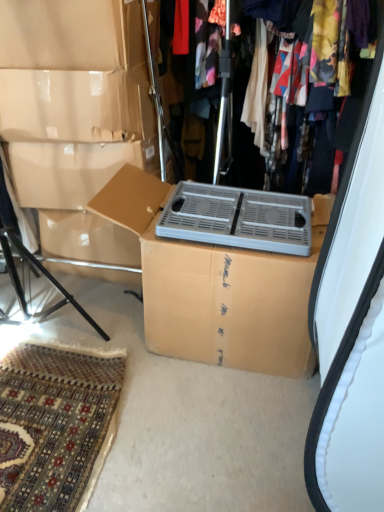
You are a GUI agent. You are given a task and a screenshot of the screen. Output one action in this format:
    pyautogui.click(x=<x>, y=<y>)
    Task: Click on the gray plastic crate at center
    
    Given the screenshot: What is the action you would take?
    pyautogui.click(x=238, y=218)

The image size is (384, 512). Identify the location of cardboard box at center. pyautogui.click(x=217, y=287).

The width and height of the screenshot is (384, 512). Describe the element at coordinates (73, 98) in the screenshot. I see `beige cardboard box at center` at that location.

Find the location of `gray plastic crate at center`. gray plastic crate at center is located at coordinates (238, 218).

Is point (156, 195) closer or farther from the camera than point (33, 13)?

Point (156, 195) appears to be farther away from the viewer than point (33, 13).

In terms of size, does cardboard box at center appear bigger or smaller than beige cardboard box at center?

cardboard box at center is bigger than beige cardboard box at center.

Does cardboard box at center lie behind beige cardboard box at center?

No, the depth of cardboard box at center is less than that of beige cardboard box at center.

Can you confirm if cardboard box at center is shorter than beige cardboard box at center?

Indeed, cardboard box at center has a lesser height compared to beige cardboard box at center.

Looking at this image, from a real-world perspective, who is located higher, gray plastic crate at center or beige cardboard box at center?

From a 3D spatial view, beige cardboard box at center is above.

Is gray plastic crate at center inside or outside of beige cardboard box at center?

gray plastic crate at center is not inside beige cardboard box at center, it's outside.

Is gray plastic crate at center facing towards beige cardboard box at center?

No.

Is metallic silver heater at upper center thinner than cardboard box at center?

Correct, the width of metallic silver heater at upper center is less than that of cardboard box at center.

From the image's perspective, is metallic silver heater at upper center positioned above or below cardboard box at center?

metallic silver heater at upper center is situated higher than cardboard box at center in the image.

Is metallic silver heater at upper center shorter than cardboard box at center?

Incorrect, the height of metallic silver heater at upper center does not fall short of that of cardboard box at center.

Is metallic silver heater at upper center at the right side of cardboard box at center?

Yes.

Is beige cardboard box at center taller than gray plastic crate at center?

Yes, beige cardboard box at center is taller than gray plastic crate at center.

In the scene shown: What's the angular difference between beige cardboard box at center and gray plastic crate at center's facing directions?

There is a 0.501-degree angle between the facing directions of beige cardboard box at center and gray plastic crate at center.

From a real-world perspective, is beige cardboard box at center located beneath gray plastic crate at center?

Actually, beige cardboard box at center is physically above gray plastic crate at center in the real world.

Is beige cardboard box at center positioned behind gray plastic crate at center?

That is True.

Is beige cardboard box at center positioned beyond the bounds of cardboard box at center?

Yes.

Does beige cardboard box at center have a smaller size compared to cardboard box at center?

Yes, beige cardboard box at center is smaller than cardboard box at center.

From the image's perspective, relative to cardboard box at center, is beige cardboard box at center above or below?

beige cardboard box at center is situated higher than cardboard box at center in the image.

Does point (214, 199) come in front of point (320, 185)?

Yes, it is in front of point (320, 185).

Based on their sizes in the image, would you say gray plastic crate at center is bigger or smaller than metallic silver heater at upper center?

In the image, gray plastic crate at center appears to be smaller than metallic silver heater at upper center.

From the image's perspective, would you say gray plastic crate at center is positioned over metallic silver heater at upper center?

No.

Locate an element on the screen. box in front of the metallic silver heater at upper center is located at coordinates (217, 287).

From a real-world perspective, is cardboard box at center above or below metallic silver heater at upper center?

In terms of real-world spatial position, cardboard box at center is below metallic silver heater at upper center.

Between cardboard box at center and metallic silver heater at upper center, which one appears on the left side from the viewer's perspective?

cardboard box at center.

Between point (273, 263) and point (225, 162), which one is positioned behind?

Point (225, 162)

Identify the location of storage box behind the cardboard box at center. tap(73, 98).

This screenshot has height=512, width=384. Identify the location of storage box above the gray plastic crate at center (from the image's perspective). (73, 98).

Which object lies nearer to the anchor point metallic silver heater at upper center, cardboard box at center or gray plastic crate at center?

gray plastic crate at center is positioned closer to the anchor metallic silver heater at upper center.

From the image, which object appears to be farther from gray plastic crate at center, cardboard box at center or beige cardboard box at center?

beige cardboard box at center.

Estimate the real-world distances between objects in this image. Which object is further from cardboard box at center, metallic silver heater at upper center or gray plastic crate at center?

The object further to cardboard box at center is metallic silver heater at upper center.

In the scene shown: When comparing their distances from cardboard box at center, does metallic silver heater at upper center or beige cardboard box at center seem further?

Based on the image, metallic silver heater at upper center appears to be further to cardboard box at center.

Based on their spatial positions, is metallic silver heater at upper center or gray plastic crate at center closer to beige cardboard box at center?

gray plastic crate at center is closer to beige cardboard box at center.

From the image, which object appears to be farther from metallic silver heater at upper center, beige cardboard box at center or gray plastic crate at center?

gray plastic crate at center is positioned further to the anchor metallic silver heater at upper center.

Which object lies nearer to the anchor point metallic silver heater at upper center, beige cardboard box at center or cardboard box at center?

beige cardboard box at center lies closer to metallic silver heater at upper center than the other object.

From the image, which object appears to be farther from gray plastic crate at center, cardboard box at center or metallic silver heater at upper center?

metallic silver heater at upper center lies further to gray plastic crate at center than the other object.

What are the coordinates of `appliance that lies between metallic silver heater at upper center and cardboard box at center from top to bottom` in the screenshot? It's located at (238, 218).

Identify the location of appliance located between beige cardboard box at center and metallic silver heater at upper center in the left-right direction. (x=238, y=218).

Locate an element on the screen. Image resolution: width=384 pixels, height=512 pixels. box between beige cardboard box at center and metallic silver heater at upper center is located at coordinates (217, 287).

Find the location of a particular element. The width and height of the screenshot is (384, 512). box between beige cardboard box at center and gray plastic crate at center from left to right is located at coordinates (217, 287).